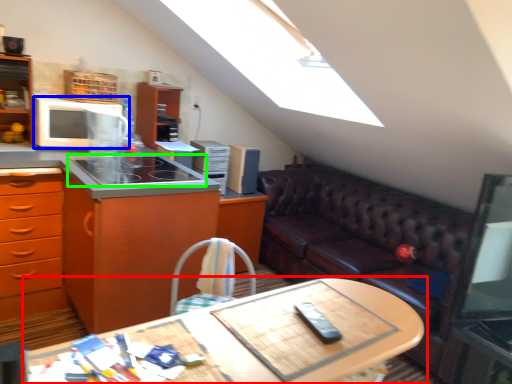
Question: Which is nearer to the table (highlighted by a red box)? microwave oven (highlighted by a blue box) or gas stove (highlighted by a green box).

Choices:
 (A) microwave oven
 (B) gas stove

Answer: (B)